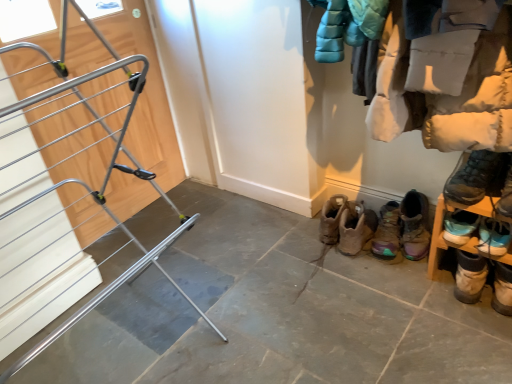
Question: Is gray stone floor at center far away from multicolored suede boot at lower right, which ranks as the fourth footwear in right-to-left order?

Choices:
 (A) no
 (B) yes

Answer: (A)

Question: From a real-world perspective, is gray stone floor at center positioned over multicolored suede boot at lower right, which ranks as the fourth footwear in right-to-left order, based on gravity?

Choices:
 (A) yes
 (B) no

Answer: (B)

Question: Is gray stone floor at center further to the viewer compared to multicolored suede boot at lower right, which ranks as the fourth footwear in right-to-left order?

Choices:
 (A) yes
 (B) no

Answer: (B)

Question: Does gray stone floor at center have a larger size compared to multicolored suede boot at lower right, which ranks as the fourth footwear in right-to-left order?

Choices:
 (A) yes
 (B) no

Answer: (A)

Question: Can you confirm if gray stone floor at center is wider than multicolored suede boot at lower right, which ranks as the fourth footwear in right-to-left order?

Choices:
 (A) yes
 (B) no

Answer: (A)

Question: Is gray stone floor at center next to multicolored suede boot at lower right, which ranks as the fourth footwear in right-to-left order, and touching it?

Choices:
 (A) no
 (B) yes

Answer: (A)

Question: Is wooden shoe rack at lower right wider than white fluffy coat at upper right?

Choices:
 (A) no
 (B) yes

Answer: (A)

Question: Is wooden shoe rack at lower right completely or partially outside of white fluffy coat at upper right?

Choices:
 (A) no
 (B) yes

Answer: (B)

Question: Can you confirm if wooden shoe rack at lower right is thinner than white fluffy coat at upper right?

Choices:
 (A) no
 (B) yes

Answer: (B)

Question: Does wooden shoe rack at lower right turn towards white fluffy coat at upper right?

Choices:
 (A) no
 (B) yes

Answer: (A)

Question: From the image's perspective, is wooden shoe rack at lower right over white fluffy coat at upper right?

Choices:
 (A) yes
 (B) no

Answer: (B)

Question: Is wooden shoe rack at lower right positioned before white fluffy coat at upper right?

Choices:
 (A) yes
 (B) no

Answer: (B)

Question: Is silver metallic drying rack at left located outside dark gray suede boot at lower right, placed as the third footwear when sorted from right to left?

Choices:
 (A) yes
 (B) no

Answer: (A)